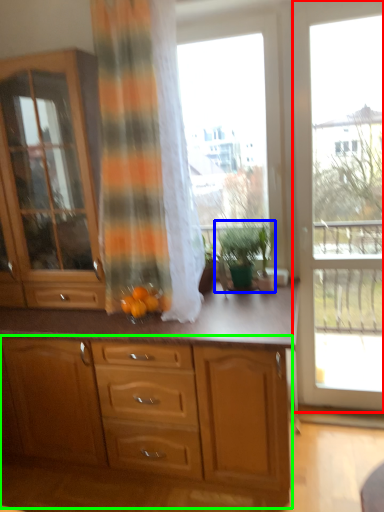
Question: Which is nearer to the window (highlighted by a red box)? houseplant (highlighted by a blue box) or cabinetry (highlighted by a green box).

Choices:
 (A) houseplant
 (B) cabinetry

Answer: (A)